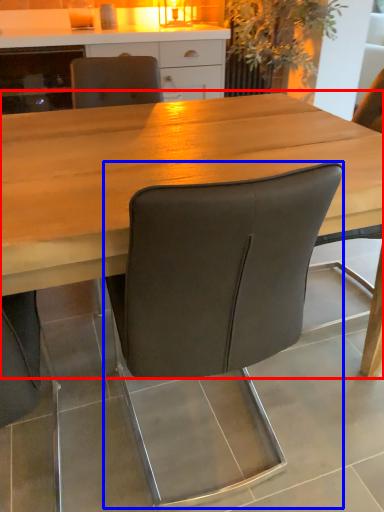
Question: Among these objects, which one is nearest to the camera, table (highlighted by a red box) or chair (highlighted by a blue box)?

Choices:
 (A) table
 (B) chair

Answer: (B)